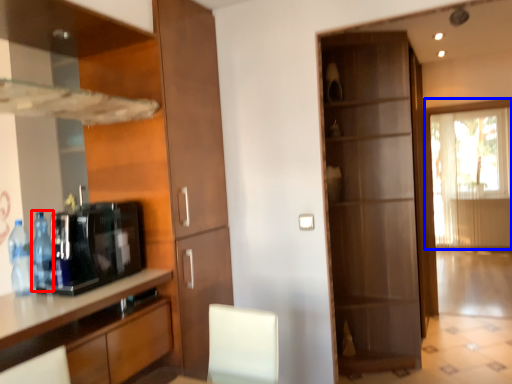
Question: Which object is further to the camera taking this photo, bottle (highlighted by a red box) or window (highlighted by a blue box)?

Choices:
 (A) bottle
 (B) window

Answer: (B)